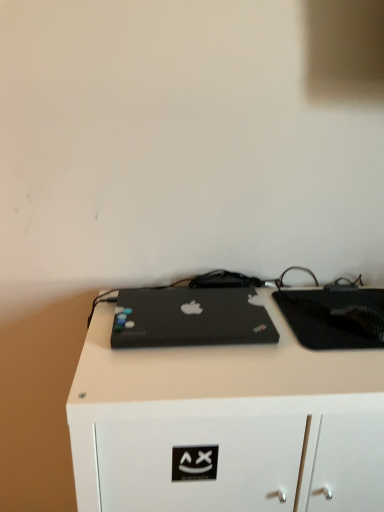
Locate an element on the screen. The image size is (384, 512). free point below black matte tablet at center (from a real-world perspective) is located at coordinates (333, 310).